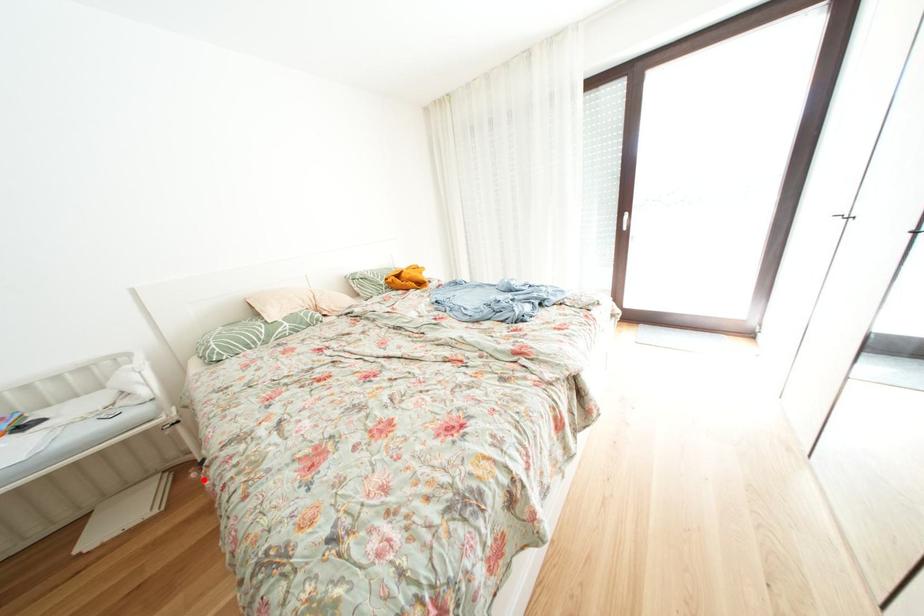
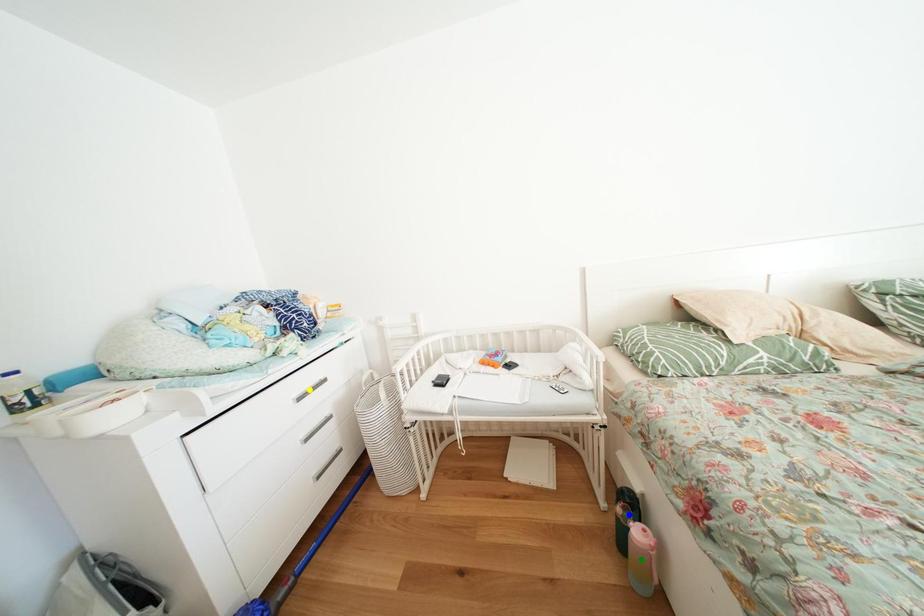
Question: I am providing you with two images of the same scene from different viewpoints. A red point is marked on the first image. You are given multiple points on the second image. Which point in image 2 represents the same 3d spot as the red point in image 1?

Choices:
 (A) blue point
 (B) yellow point
 (C) green point

Answer: (A)